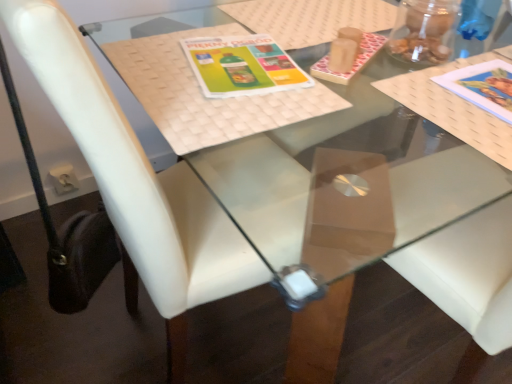
Question: Considering the relative positions of matte green plastic book cover at center, the first book cover viewed from the left, and matte paper book at upper right, which appears as the 2th book cover when viewed from the left, in the image provided, is matte green plastic book cover at center, the first book cover viewed from the left, to the left or to the right of matte paper book at upper right, which appears as the 2th book cover when viewed from the left,?

Choices:
 (A) left
 (B) right

Answer: (A)

Question: Is matte green plastic book cover at center, the first book cover viewed from the left, in front of or behind matte paper book at upper right, which ranks as the 1th book cover in right-to-left order, in the image?

Choices:
 (A) front
 (B) behind

Answer: (B)

Question: Which object is positioned farthest from the matte green plastic book cover at center, placed as the 2th book cover when sorted from right to left?

Choices:
 (A) matte paper book at upper right, which appears as the 2th book cover when viewed from the left
 (B) white leather chair at center

Answer: (A)

Question: Considering the real-world distances, which object is farthest from the matte green plastic book cover at center, the first book cover viewed from the left?

Choices:
 (A) white leather chair at center
 (B) matte paper book at upper right, which ranks as the 1th book cover in right-to-left order

Answer: (B)